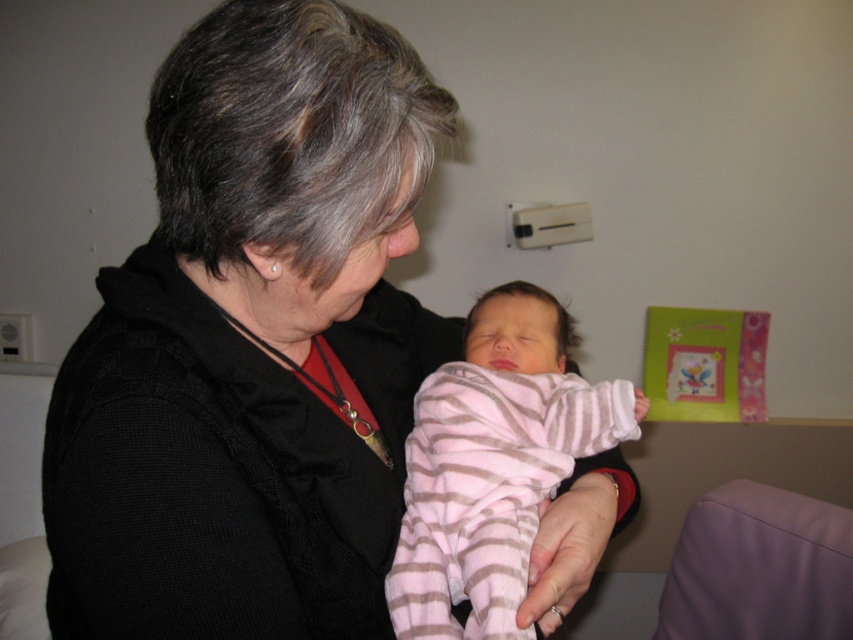
Which is behind, point (459, 506) or point (718, 605)?

Point (718, 605)

Is point (502, 611) positioned before point (718, 632)?

Yes, point (502, 611) is closer to viewer.

You are a GUI agent. You are given a task and a screenshot of the screen. Output one action in this format:
    pyautogui.click(x=<x>, y=<y>)
    Task: Click on the pink striped fabric baby at center
    Image resolution: width=853 pixels, height=640 pixels.
    Given the screenshot: What is the action you would take?
    pyautogui.click(x=494, y=465)

The width and height of the screenshot is (853, 640). Describe the element at coordinates (494, 465) in the screenshot. I see `pink striped fabric baby at center` at that location.

Can you confirm if pink striped fabric baby at center is wider than pink soft fabric at lower center?

Yes.

This screenshot has width=853, height=640. What do you see at coordinates (494, 465) in the screenshot?
I see `pink striped fabric baby at center` at bounding box center [494, 465].

Where is `pink striped fabric baby at center`? pink striped fabric baby at center is located at coordinates (494, 465).

Is black soft sweater at center wider than pink striped fabric baby at center?

Yes.

Which is more to the left, black soft sweater at center or pink striped fabric baby at center?

Positioned to the left is black soft sweater at center.

Does point (248, 550) come in front of point (514, 340)?

Yes, it is.

Find the location of a particular element. Image resolution: width=853 pixels, height=640 pixels. black soft sweater at center is located at coordinates (253, 342).